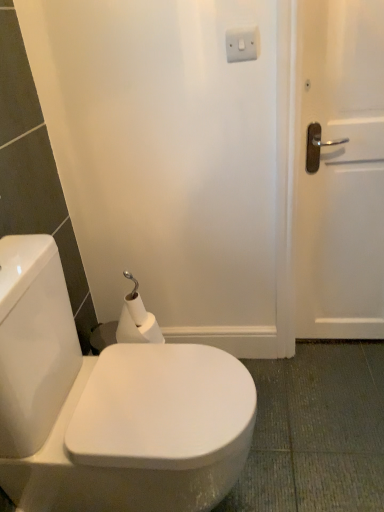
Question: Is white matte toilet paper at lower left shorter than white plastic switch at upper center?

Choices:
 (A) yes
 (B) no

Answer: (B)

Question: Does white matte toilet paper at lower left turn towards white plastic switch at upper center?

Choices:
 (A) no
 (B) yes

Answer: (A)

Question: From the image's perspective, is white matte toilet paper at lower left beneath white plastic switch at upper center?

Choices:
 (A) yes
 (B) no

Answer: (A)

Question: Can you confirm if white matte toilet paper at lower left is thinner than white plastic switch at upper center?

Choices:
 (A) no
 (B) yes

Answer: (A)

Question: Can you confirm if white matte toilet paper at lower left is bigger than white plastic switch at upper center?

Choices:
 (A) no
 (B) yes

Answer: (B)

Question: Is white matte toilet paper at lower left not near white plastic switch at upper center?

Choices:
 (A) yes
 (B) no

Answer: (B)

Question: From a real-world perspective, is white plastic switch at upper center physically below white matte toilet paper at lower left?

Choices:
 (A) no
 (B) yes

Answer: (A)

Question: Is white plastic switch at upper center turned away from white matte toilet paper at lower left?

Choices:
 (A) no
 (B) yes

Answer: (A)

Question: Does white plastic switch at upper center come behind white matte toilet paper at lower left?

Choices:
 (A) no
 (B) yes

Answer: (A)

Question: Is white plastic switch at upper center located outside white matte toilet paper at lower left?

Choices:
 (A) no
 (B) yes

Answer: (B)

Question: Is white plastic switch at upper center not close to white matte toilet paper at lower left?

Choices:
 (A) yes
 (B) no

Answer: (B)

Question: Can you confirm if white plastic switch at upper center is thinner than white matte toilet paper at lower left?

Choices:
 (A) no
 (B) yes

Answer: (B)

Question: Does white plastic switch at upper center appear on the right side of white glossy toilet at center?

Choices:
 (A) yes
 (B) no

Answer: (A)